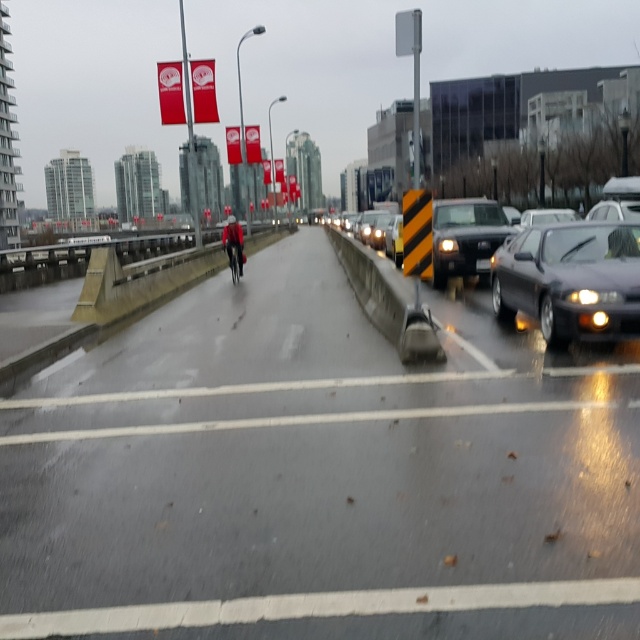
Who is more distant from viewer, (257,385) or (595,280)?

The point (257,385) is behind.

Image resolution: width=640 pixels, height=640 pixels. What do you see at coordinates (317, 474) in the screenshot? I see `smooth asphalt highway at center` at bounding box center [317, 474].

Image resolution: width=640 pixels, height=640 pixels. I want to click on smooth asphalt highway at center, so click(317, 474).

Does shiny black sedan at right appear under matte black suv at center?

Yes, shiny black sedan at right is below matte black suv at center.

Between shiny black sedan at right and matte black suv at center, which one has less height?

shiny black sedan at right is shorter.

The width and height of the screenshot is (640, 640). What do you see at coordinates (570, 280) in the screenshot?
I see `shiny black sedan at right` at bounding box center [570, 280].

Find the location of a particular element. This screenshot has height=640, width=640. shiny black sedan at right is located at coordinates (570, 280).

Can you confirm if smooth asphalt highway at center is positioned above matte black suv at center?

No, smooth asphalt highway at center is not above matte black suv at center.

Between point (586, 595) and point (486, 268), which one is positioned behind?

Positioned behind is point (486, 268).

Locate an element on the screen. The height and width of the screenshot is (640, 640). smooth asphalt highway at center is located at coordinates (317, 474).